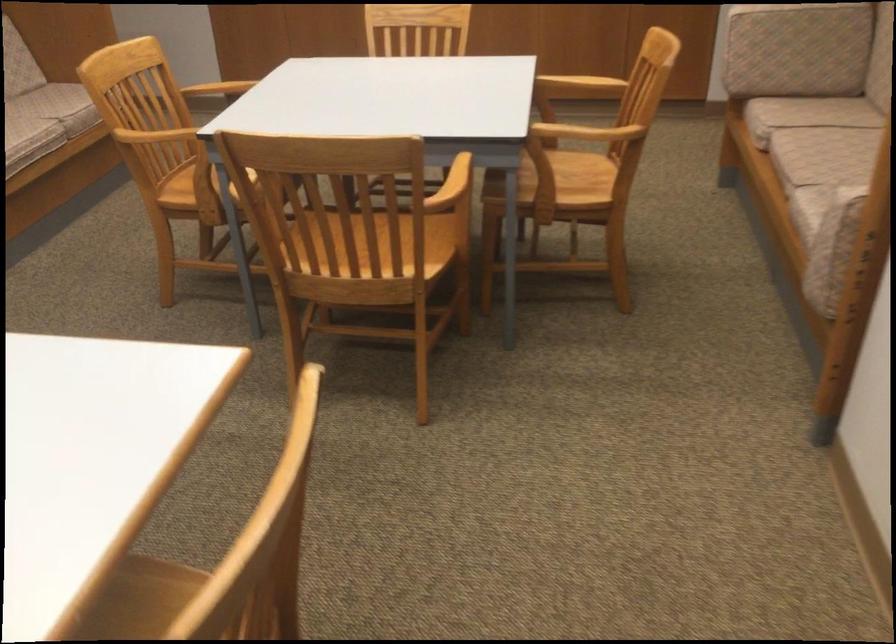
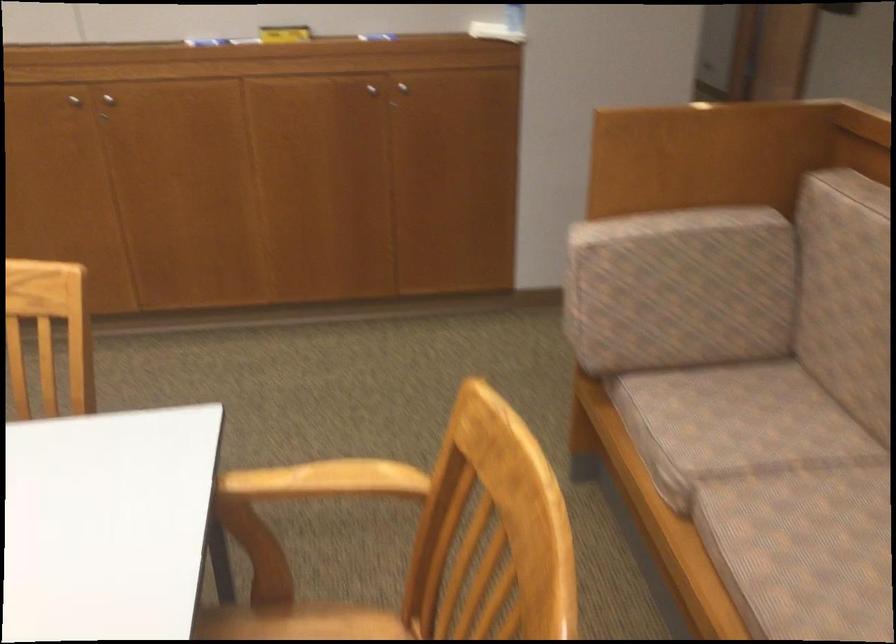
Question: Which direction would the cameraman need to move to produce the second image? Reply with the corresponding letter.

Choices:
 (A) Left
 (B) Right
 (C) Forward
 (D) Backward

Answer: (C)